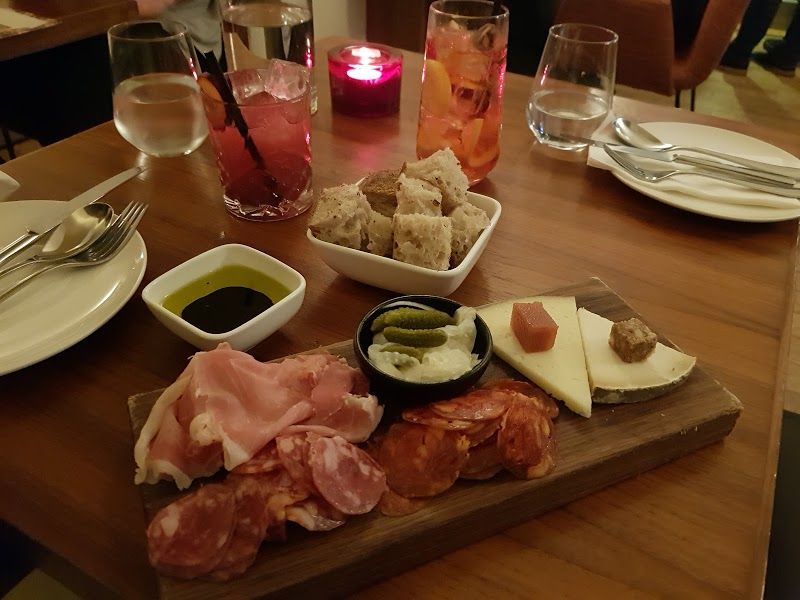
Identify the location of tealight candle holder. (366, 103).